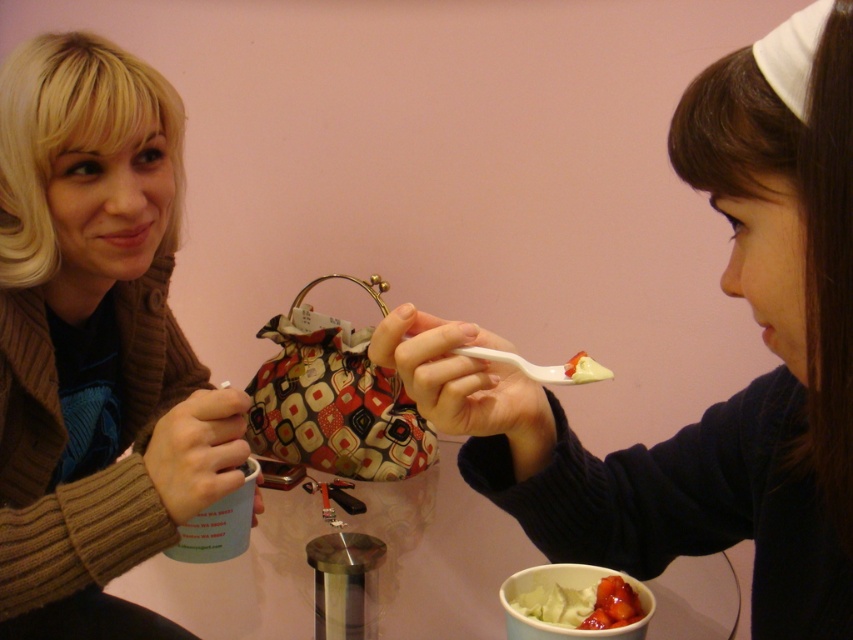
Is white matte spoon at upper center above matte brown sweater at left?

No, white matte spoon at upper center is not above matte brown sweater at left.

Which of these two, white matte spoon at upper center or matte brown sweater at left, stands shorter?

With less height is white matte spoon at upper center.

Does point (685, 115) come closer to viewer compared to point (10, 416)?

Yes.

The image size is (853, 640). Find the location of `white matte spoon at upper center`. white matte spoon at upper center is located at coordinates (730, 396).

Is point (457, 378) positioned before point (544, 618)?

Yes, it is in front of point (544, 618).

Can you confirm if white matte spoon at upper center is shorter than white creamy dessert at lower center?

No, white matte spoon at upper center is not shorter than white creamy dessert at lower center.

Identify the location of white matte spoon at upper center. (730, 396).

Is matte brown sweater at left thinner than white creamy dessert at lower center?

In fact, matte brown sweater at left might be wider than white creamy dessert at lower center.

Can you confirm if matte brown sweater at left is positioned to the left of white creamy dessert at lower center?

Yes, matte brown sweater at left is to the left of white creamy dessert at lower center.

Who is more distant from viewer, [161,260] or [618,579]?

Positioned behind is point [161,260].

The height and width of the screenshot is (640, 853). I want to click on matte brown sweater at left, so click(96, 342).